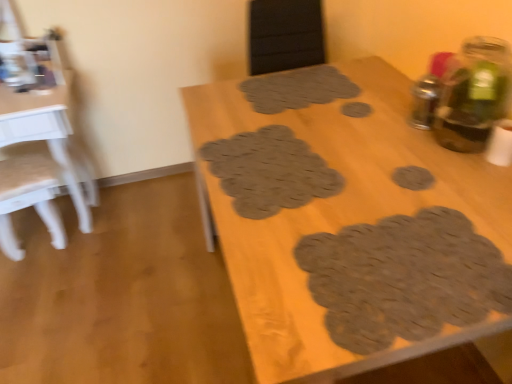
The height and width of the screenshot is (384, 512). Identify the location of free space to the left of brown textured placemats at center, which is the 1th table from right to left. (135, 299).